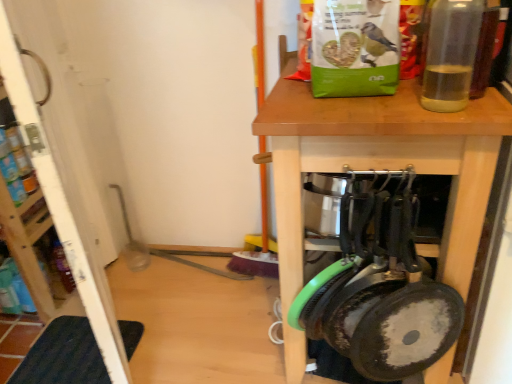
Describe the element at coordinates (451, 54) in the screenshot. I see `transparent plastic bottle at upper right` at that location.

This screenshot has width=512, height=384. Find the location of `white wood screen door at left`. white wood screen door at left is located at coordinates (64, 208).

From the image's perspective, is dark blue rubber mat at lower left located above or below transparent plastic bottle at upper right?

dark blue rubber mat at lower left is situated lower than transparent plastic bottle at upper right in the image.

Which is in front, point (61, 365) or point (461, 77)?

The point (461, 77) is in front.

Are white wood screen door at left and transparent plastic bottle at upper right making contact?

No, white wood screen door at left is not touching transparent plastic bottle at upper right.

Looking at the image, does white wood screen door at left seem bigger or smaller compared to transparent plastic bottle at upper right?

Considering their sizes, white wood screen door at left takes up more space than transparent plastic bottle at upper right.

From the image's perspective, between white wood screen door at left and transparent plastic bottle at upper right, who is located below?

white wood screen door at left is shown below in the image.

Considering the sizes of objects white wood screen door at left and transparent plastic bottle at upper right in the image provided, who is taller, white wood screen door at left or transparent plastic bottle at upper right?

white wood screen door at left is taller.

Could you tell me if wooden table at center is turned towards dark blue rubber mat at lower left?

No.

From the image's perspective, is wooden table at center above or below dark blue rubber mat at lower left?

Based on their image positions, wooden table at center is located above dark blue rubber mat at lower left.

Considering the sizes of objects wooden table at center and dark blue rubber mat at lower left in the image provided, who is wider, wooden table at center or dark blue rubber mat at lower left?

With larger width is wooden table at center.

Which is closer to the camera, (x=267, y=104) or (x=40, y=336)?

Point (x=267, y=104)

Which is nearer, (21, 126) or (51, 348)?

The point (21, 126) is closer to the camera.

Relative to dark blue rubber mat at lower left, is white wood screen door at left in front or behind?

In the image, white wood screen door at left appears in front of dark blue rubber mat at lower left.

From the image's perspective, is white wood screen door at left above or below dark blue rubber mat at lower left?

From the image's perspective, white wood screen door at left appears above dark blue rubber mat at lower left.

Is white wood screen door at left to the left or to the right of dark blue rubber mat at lower left in the image?

From the image, it's evident that white wood screen door at left is to the left of dark blue rubber mat at lower left.

Is point (448, 6) farther from viewer compared to point (65, 174)?

No, (448, 6) is in front of (65, 174).

From the picture: Is white wood screen door at left completely or partially inside transparent plastic bottle at upper right?

Definitely not — white wood screen door at left is not inside transparent plastic bottle at upper right.

Is the depth of transparent plastic bottle at upper right greater than that of white wood screen door at left?

No, transparent plastic bottle at upper right is closer to the viewer.

Is transparent plastic bottle at upper right positioned with its back to white wood screen door at left?

No, transparent plastic bottle at upper right is not facing the opposite direction of white wood screen door at left.

Considering the relative sizes of white wood screen door at left and wooden table at center in the image provided, is white wood screen door at left smaller than wooden table at center?

Yes, white wood screen door at left is smaller than wooden table at center.

From the image's perspective, who appears lower, white wood screen door at left or wooden table at center?

wooden table at center, from the image's perspective.

In the scene shown: Is white wood screen door at left looking in the opposite direction of wooden table at center?

No, white wood screen door at left is not facing away from wooden table at center.

From the picture: From the image's perspective, is wooden table at center positioned above or below transparent plastic bottle at upper right?

From the image's perspective, wooden table at center appears below transparent plastic bottle at upper right.

Is there a large distance between wooden table at center and transparent plastic bottle at upper right?

No, wooden table at center is not far from transparent plastic bottle at upper right.

Is the position of wooden table at center less distant than that of transparent plastic bottle at upper right?

No, wooden table at center is behind transparent plastic bottle at upper right.

Which is in front, point (398, 140) or point (473, 3)?

The point (473, 3) is closer to the camera.

The image size is (512, 384). What are the coordinates of `mat behind the transparent plastic bottle at upper right` in the screenshot? It's located at (63, 356).

Identify the location of screen door below the transparent plastic bottle at upper right (from the image's perspective). The height and width of the screenshot is (384, 512). (64, 208).

Looking at the image, which one is located closer to white wood screen door at left, dark blue rubber mat at lower left or wooden table at center?

Based on the image, dark blue rubber mat at lower left appears to be nearer to white wood screen door at left.

Based on their spatial positions, is transparent plastic bottle at upper right or white wood screen door at left closer to wooden table at center?

transparent plastic bottle at upper right lies closer to wooden table at center than the other object.

Based on their spatial positions, is dark blue rubber mat at lower left or wooden table at center further from transparent plastic bottle at upper right?

Based on the image, dark blue rubber mat at lower left appears to be further to transparent plastic bottle at upper right.

Consider the image. Which object lies further to the anchor point transparent plastic bottle at upper right, wooden table at center or white wood screen door at left?

white wood screen door at left is further to transparent plastic bottle at upper right.

From the picture: Estimate the real-world distances between objects in this image. Which object is closer to wooden table at center, white wood screen door at left or dark blue rubber mat at lower left?

white wood screen door at left is positioned closer to the anchor wooden table at center.

Estimate the real-world distances between objects in this image. Which object is closer to white wood screen door at left, wooden table at center or transparent plastic bottle at upper right?

wooden table at center lies closer to white wood screen door at left than the other object.

From the image, which object appears to be nearer to dark blue rubber mat at lower left, transparent plastic bottle at upper right or wooden table at center?

wooden table at center lies closer to dark blue rubber mat at lower left than the other object.

Considering their positions, is dark blue rubber mat at lower left positioned further to transparent plastic bottle at upper right than white wood screen door at left?

Among the two, dark blue rubber mat at lower left is located further to transparent plastic bottle at upper right.

Find the location of a particular element. desk between white wood screen door at left and transparent plastic bottle at upper right from left to right is located at coordinates (377, 168).

The image size is (512, 384). I want to click on desk located between dark blue rubber mat at lower left and transparent plastic bottle at upper right in the left-right direction, so click(x=377, y=168).

This screenshot has width=512, height=384. In order to click on mat situated between white wood screen door at left and transparent plastic bottle at upper right from left to right in this screenshot , I will do `click(63, 356)`.

The height and width of the screenshot is (384, 512). I want to click on mat situated between white wood screen door at left and wooden table at center from left to right, so click(x=63, y=356).